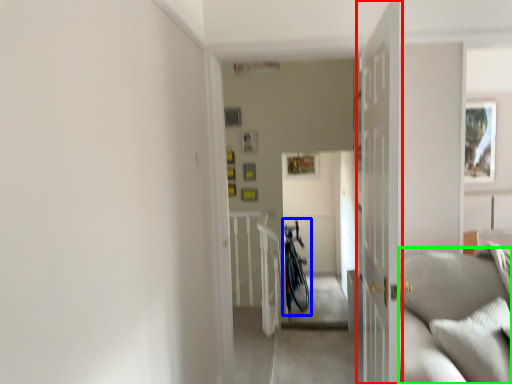
Question: Based on their relative distances, which object is farther from door (highlighted by a red box)? Choose from bicycle (highlighted by a blue box) and couch (highlighted by a green box).

Choices:
 (A) bicycle
 (B) couch

Answer: (A)